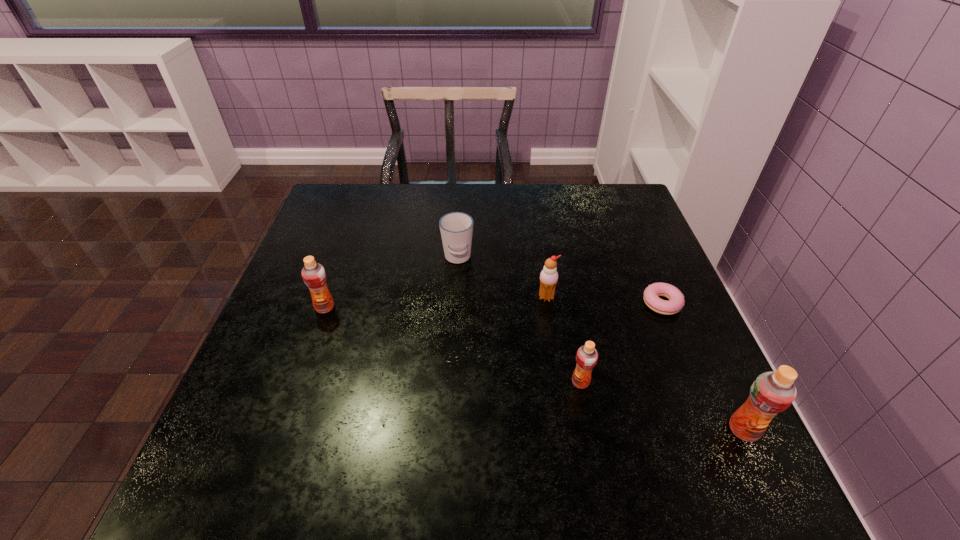
Identify the location of blank space located on the right of the second shortest orange juice. This screenshot has width=960, height=540. (438, 307).

Identify the location of free space located on the left of the second farthest orange juice. (456, 382).

The height and width of the screenshot is (540, 960). What are the coordinates of `vacant space situated on the back of the rightmost orange juice` in the screenshot? It's located at (687, 310).

Locate an element on the screen. This screenshot has height=540, width=960. free space located with a handle on the side of the second object from left to right is located at coordinates (454, 321).

This screenshot has width=960, height=540. What are the coordinates of `vacant space situated on the front of the doughnut` in the screenshot? It's located at (683, 353).

Locate an element on the screen. Image resolution: width=960 pixels, height=540 pixels. free spot located 0.070m at the front with a straw on the fourth object from right to left is located at coordinates (551, 326).

Locate an element on the screen. The image size is (960, 540). object located at the near edge is located at coordinates (771, 393).

You are a GUI agent. You are given a task and a screenshot of the screen. Output one action in this format:
    pyautogui.click(x=<x>, y=<y>)
    Task: Click on the object located at the left edge
    The width and height of the screenshot is (960, 540).
    Given the screenshot: What is the action you would take?
    pyautogui.click(x=314, y=276)

Find the location of a particular element. orange juice that is positioned at the right edge is located at coordinates (771, 393).

You are a GUI agent. You are given a task and a screenshot of the screen. Output one action in this format:
    pyautogui.click(x=<x>, y=<y>)
    Task: Click on the doughnut that is at the right edge
    Image resolution: width=960 pixels, height=540 pixels.
    Given the screenshot: What is the action you would take?
    pyautogui.click(x=676, y=302)